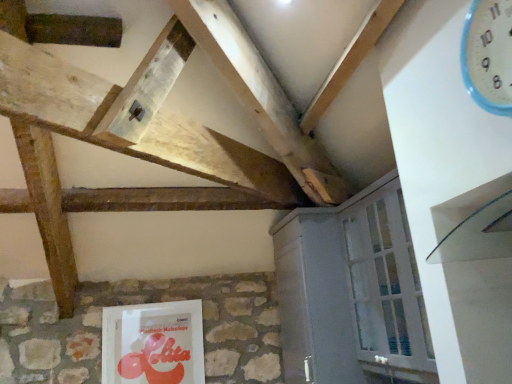
Question: Is white painted wood cabinet at lower right directly adjacent to matte plastic book at lower center?

Choices:
 (A) no
 (B) yes

Answer: (A)

Question: Is white painted wood cabinet at lower right facing away from matte plastic book at lower center?

Choices:
 (A) no
 (B) yes

Answer: (A)

Question: Is white painted wood cabinet at lower right positioned behind matte plastic book at lower center?

Choices:
 (A) yes
 (B) no

Answer: (B)

Question: Considering the relative sizes of white painted wood cabinet at lower right and matte plastic book at lower center in the image provided, is white painted wood cabinet at lower right taller than matte plastic book at lower center?

Choices:
 (A) no
 (B) yes

Answer: (B)

Question: Can you confirm if white painted wood cabinet at lower right is bigger than matte plastic book at lower center?

Choices:
 (A) yes
 (B) no

Answer: (A)

Question: Does point (334, 345) appear closer or farther from the camera than point (182, 350)?

Choices:
 (A) closer
 (B) farther

Answer: (A)

Question: Is white painted wood cabinet at lower right to the left or to the right of matte plastic book at lower center in the image?

Choices:
 (A) right
 (B) left

Answer: (A)

Question: From the image's perspective, is white painted wood cabinet at lower right above or below matte plastic book at lower center?

Choices:
 (A) below
 (B) above

Answer: (B)

Question: Considering their positions, is white painted wood cabinet at lower right located in front of or behind matte plastic book at lower center?

Choices:
 (A) front
 (B) behind

Answer: (A)

Question: From a real-world perspective, is matte plastic book at lower center positioned above or below white plastic clock at upper right?

Choices:
 (A) above
 (B) below

Answer: (B)

Question: Visually, is matte plastic book at lower center positioned to the left or to the right of white plastic clock at upper right?

Choices:
 (A) left
 (B) right

Answer: (A)

Question: From the image's perspective, relative to white plastic clock at upper right, is matte plastic book at lower center above or below?

Choices:
 (A) above
 (B) below

Answer: (B)

Question: Is matte plastic book at lower center inside the boundaries of white plastic clock at upper right, or outside?

Choices:
 (A) inside
 (B) outside

Answer: (B)

Question: Is white painted wood cabinet at lower right in front of or behind white plastic clock at upper right in the image?

Choices:
 (A) front
 (B) behind

Answer: (B)

Question: Considering the relative positions of white painted wood cabinet at lower right and white plastic clock at upper right in the image provided, is white painted wood cabinet at lower right to the left or to the right of white plastic clock at upper right?

Choices:
 (A) left
 (B) right

Answer: (A)